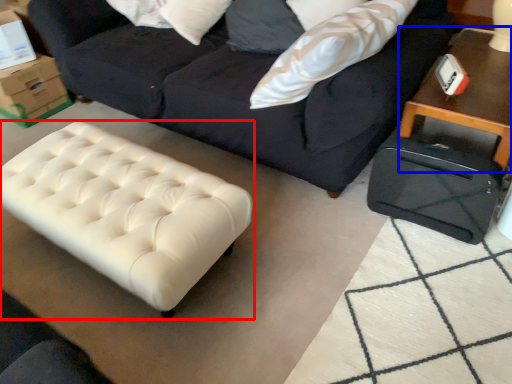
Question: Which object appears farthest to the camera in this image, table (highlighted by a red box) or table (highlighted by a blue box)?

Choices:
 (A) table
 (B) table

Answer: (B)